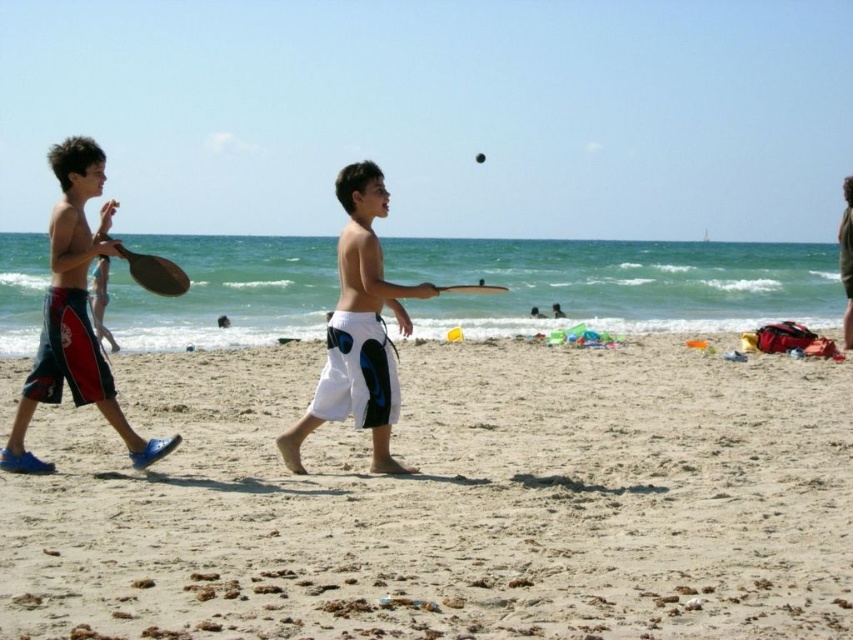
Between blue fabric shorts at left and white cotton shorts at center, which one appears on the left side from the viewer's perspective?

Positioned to the left is blue fabric shorts at left.

Is point (38, 372) behind point (364, 209)?

Yes.

Image resolution: width=853 pixels, height=640 pixels. Identify the location of blue fabric shorts at left. (74, 314).

Between white cotton shorts at center and green cotton shorts at center, which one is positioned lower?

white cotton shorts at center is lower down.

In the scene shown: Is white cotton shorts at center thinner than green cotton shorts at center?

Yes.

Where is `white cotton shorts at center`? The height and width of the screenshot is (640, 853). white cotton shorts at center is located at coordinates (358, 330).

Between blue fabric shorts at left and green cotton shorts at center, which one has less height?

Standing shorter between the two is blue fabric shorts at left.

Who is more distant from viewer, [125,419] or [845,182]?

The point [845,182] is behind.

This screenshot has height=640, width=853. I want to click on blue fabric shorts at left, so click(x=74, y=314).